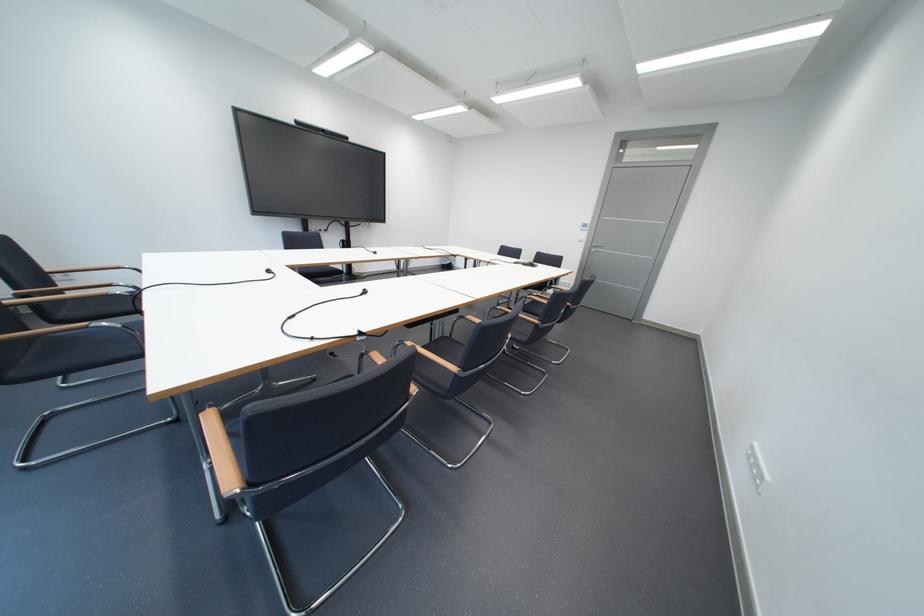
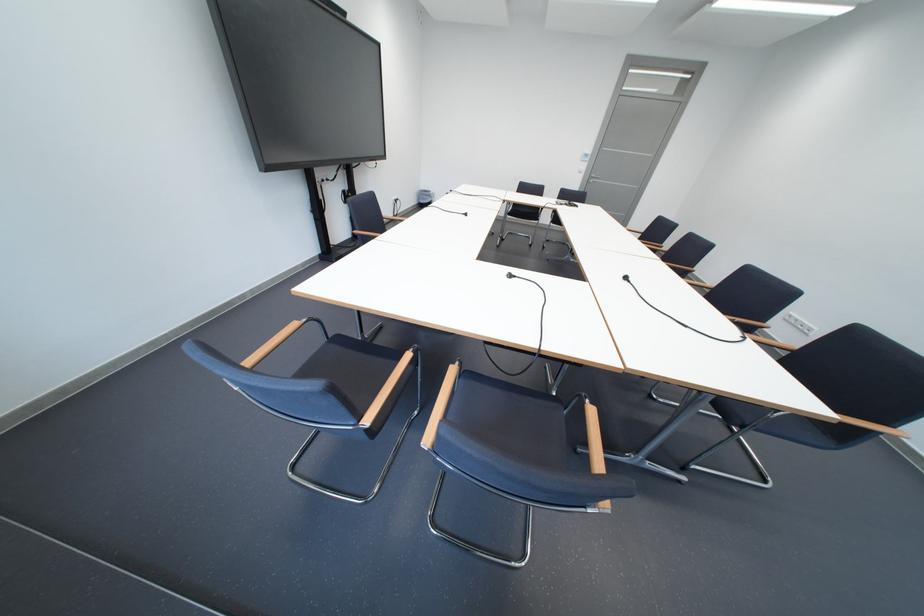
The point at (596,237) is marked in the first image. Where is the corresponding point in the second image?

(596, 168)